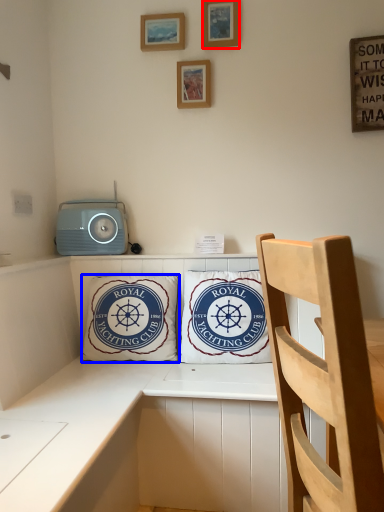
Question: Which point is further to the camera, picture frame (highlighted by a red box) or pillow (highlighted by a blue box)?

Choices:
 (A) picture frame
 (B) pillow

Answer: (A)